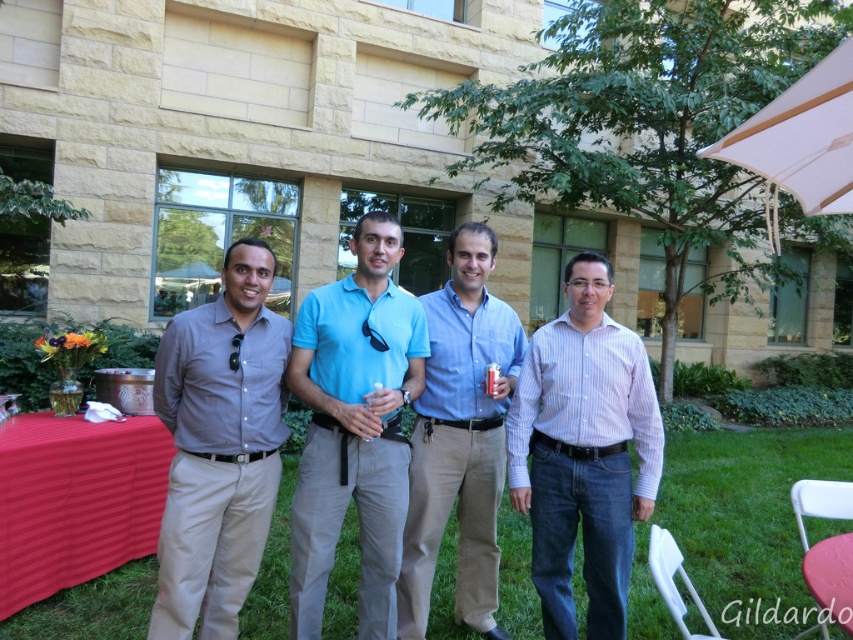
You are a photographer setting up for a group photo. The light blue polo shirt at center and the black satin tie at center are part of the subjects. Given that your camera has a depth of field that can focus clearly on objects within 24 inches, will both items be in focus simultaneously?

The distance between the light blue polo shirt at center and the black satin tie at center is 24.17 inches. Since the camera can focus within 24 inches, they will not both be in focus simultaneously because the distance exceeds the camera limit.

You are standing at point (746,516) in the image. What is the terrain like at this location?

The terrain at point (746,516) is green grass at lower center.